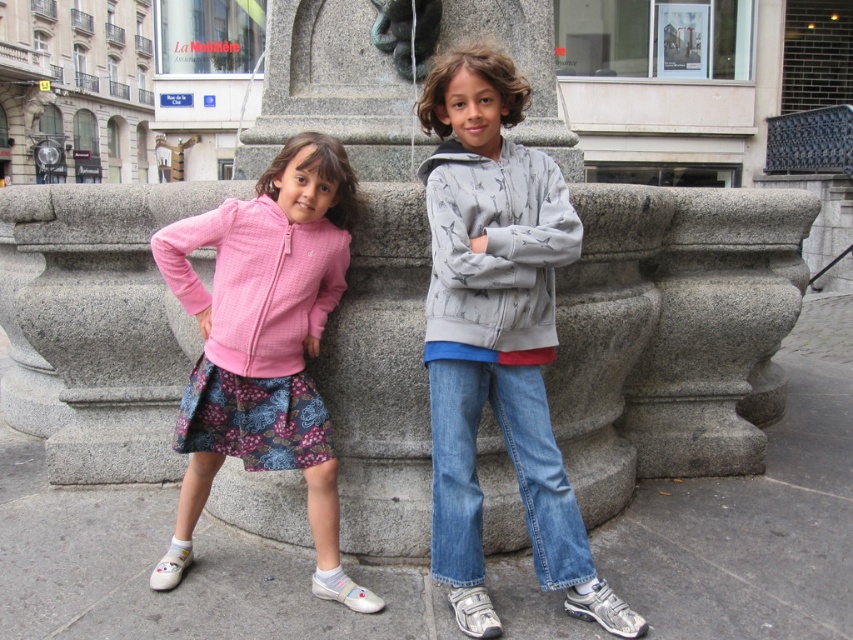
Question: Which of the following is the farthest from the observer?

Choices:
 (A) matte pink sweatshirt at left
 (B) gray textured hoodie at center
 (C) gray cotton sweatshirt at center

Answer: (A)

Question: Which of these objects is positioned closest to the gray textured hoodie at center?

Choices:
 (A) gray cotton sweatshirt at center
 (B) matte pink sweatshirt at left

Answer: (A)

Question: Is pink fleece jacket at center to the left of matte pink sweatshirt at left from the viewer's perspective?

Choices:
 (A) no
 (B) yes

Answer: (A)

Question: Does pink fleece jacket at center appear over matte pink sweatshirt at left?

Choices:
 (A) yes
 (B) no

Answer: (B)

Question: Which point is closer to the camera taking this photo?

Choices:
 (A) (461, 49)
 (B) (315, 296)
 (C) (469, 348)
 (D) (282, 220)

Answer: (C)

Question: Is gray cotton sweatshirt at center thinner than matte pink sweatshirt at left?

Choices:
 (A) no
 (B) yes

Answer: (B)